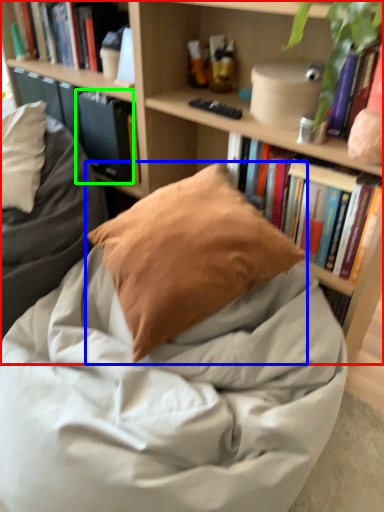
Question: Which is farther away from bookcase (highlighted by a red box)? pillow (highlighted by a blue box) or paperback book (highlighted by a green box)?

Choices:
 (A) pillow
 (B) paperback book

Answer: (A)